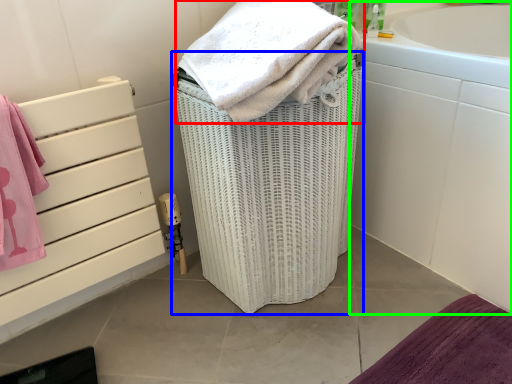
Question: Considering the real-world distances, which object is closest to towel (highlighted by a red box)? basket container (highlighted by a blue box) or bath (highlighted by a green box).

Choices:
 (A) basket container
 (B) bath

Answer: (A)